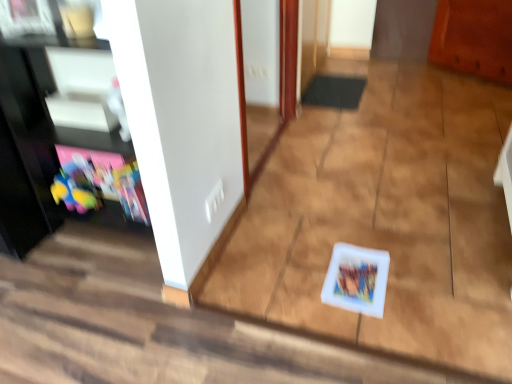
This screenshot has width=512, height=384. Describe the element at coordinates (474, 38) in the screenshot. I see `wooden cabinet at upper right` at that location.

The width and height of the screenshot is (512, 384). In order to click on wooden cabinet at upper right in this screenshot , I will do pos(474,38).

Image resolution: width=512 pixels, height=384 pixels. What do you see at coordinates (153, 326) in the screenshot?
I see `white plastic book at center` at bounding box center [153, 326].

Find the location of a particular element. Image resolution: width=512 pixels, height=384 pixels. white plastic book at center is located at coordinates (153, 326).

The height and width of the screenshot is (384, 512). What do you see at coordinates (357, 279) in the screenshot? I see `white matte card game at center` at bounding box center [357, 279].

Looking at this image, measure the distance between point (x=242, y=24) and camera.

Point (x=242, y=24) and camera are 8.22 feet apart from each other.

I want to click on wooden cabinet at upper right, so click(x=474, y=38).

Consider the image. Considering the sizes of white matte card game at center and white plastic book at center in the image, is white matte card game at center taller or shorter than white plastic book at center?

In the image, white matte card game at center appears to be shorter than white plastic book at center.

Is white matte card game at center oriented towards white plastic book at center?

Yes, white matte card game at center is turned towards white plastic book at center.

Can we say white matte card game at center lies outside white plastic book at center?

No, white matte card game at center is not entirely external to white plastic book at center.

From the image's perspective, which is below, white matte card game at center or white plastic book at center?

white plastic book at center is shown below in the image.

Does black rubber doormat at center lie in front of matt black shelf at left?

No, black rubber doormat at center is further to the viewer.

How many degrees apart are the facing directions of black rubber doormat at center and matt black shelf at left?

black rubber doormat at center and matt black shelf at left are facing 90 degrees away from each other.

From the image's perspective, is black rubber doormat at center under matt black shelf at left?

Actually, black rubber doormat at center appears above matt black shelf at left in the image.

From the picture: Is black rubber doormat at center located outside matt black shelf at left?

black rubber doormat at center is positioned outside matt black shelf at left.

Is white plastic book at center not near matt black shelf at left?

No, white plastic book at center is in close proximity to matt black shelf at left.

From a real-world perspective, which object rests below the other?

white plastic book at center, from a real-world perspective.

Between point (254, 375) and point (88, 188), which one is positioned behind?

Positioned behind is point (88, 188).

Does black rubber doormat at center turn towards white plastic book at center?

No.

Would you say black rubber doormat at center is a long distance from white plastic book at center?

That's right, there is a large distance between black rubber doormat at center and white plastic book at center.

Is black rubber doormat at center wider than white plastic book at center?

No, black rubber doormat at center is not wider than white plastic book at center.

From the image's perspective, is black rubber doormat at center above or below white plastic book at center?

Clearly, from the image's perspective, black rubber doormat at center is above white plastic book at center.

Considering the sizes of black glossy entertainment center at left and white matte card game at center in the image, is black glossy entertainment center at left wider or thinner than white matte card game at center?

In the image, black glossy entertainment center at left appears to be wider than white matte card game at center.

What's the angular difference between black glossy entertainment center at left and white matte card game at center's facing directions?

There is a 180-degree angle between the facing directions of black glossy entertainment center at left and white matte card game at center.

In the image, is black glossy entertainment center at left positioned in front of or behind white matte card game at center?

In the image, black glossy entertainment center at left appears in front of white matte card game at center.

Is black glossy entertainment center at left looking in the opposite direction of white matte card game at center?

No, black glossy entertainment center at left is not facing away from white matte card game at center.

In the image, is white matte card game at center on the left side or the right side of matt black shelf at left?

From the image, it's evident that white matte card game at center is to the right of matt black shelf at left.

Can you confirm if white matte card game at center is taller than matt black shelf at left?

In fact, white matte card game at center may be shorter than matt black shelf at left.

In the image, is white matte card game at center positioned in front of or behind matt black shelf at left?

Clearly, white matte card game at center is in front of matt black shelf at left.

Between white matte card game at center and matt black shelf at left, which one has larger width?

Wider between the two is white matte card game at center.

Could you tell me if wooden cabinet at upper right is turned towards white plastic book at center?

Yes, wooden cabinet at upper right is oriented towards white plastic book at center.

Is there a large distance between wooden cabinet at upper right and white plastic book at center?

Yes, wooden cabinet at upper right and white plastic book at center are located far from each other.

Considering the sizes of objects wooden cabinet at upper right and white plastic book at center in the image provided, who is shorter, wooden cabinet at upper right or white plastic book at center?

With less height is white plastic book at center.

You are a GUI agent. You are given a task and a screenshot of the screen. Output one action in this format:
    pyautogui.click(x=<x>, y=<y>)
    Task: Click on the stair above the white matte card game at center (from a real-world perspective)
    The image size is (512, 384).
    Given the screenshot: What is the action you would take?
    pyautogui.click(x=153, y=326)

Identify the location of doormat located behind the matt black shelf at left. (334, 91).

Considering their positions, is white matte card game at center positioned closer to wooden cabinet at upper right than black rubber doormat at center?

black rubber doormat at center is positioned closer to the anchor wooden cabinet at upper right.

Looking at the image, which one is located further to white glossy door at center, white plastic book at center or black rubber doormat at center?

white plastic book at center is positioned further to the anchor white glossy door at center.

From the image, which object appears to be nearer to black glossy entertainment center at left, white plastic book at center or white glossy door at center?

white plastic book at center.

Looking at the image, which one is located closer to white plastic book at center, matt black shelf at left or wooden cabinet at upper right?

The object closer to white plastic book at center is matt black shelf at left.

Estimate the real-world distances between objects in this image. Which object is further from matt black shelf at left, white matte card game at center or black glossy entertainment center at left?

white matte card game at center is positioned further to the anchor matt black shelf at left.

Based on their spatial positions, is white glossy door at center or wooden cabinet at upper right further from matt black shelf at left?

Among the two, wooden cabinet at upper right is located further to matt black shelf at left.

Based on their spatial positions, is white matte card game at center or matt black shelf at left further from black glossy entertainment center at left?

Result: Based on the image, white matte card game at center appears to be further to black glossy entertainment center at left.

Based on their spatial positions, is black rubber doormat at center or wooden cabinet at upper right further from white glossy door at center?

The object further to white glossy door at center is wooden cabinet at upper right.

The height and width of the screenshot is (384, 512). In order to click on doormat between black glossy entertainment center at left and wooden cabinet at upper right in this screenshot , I will do `click(334, 91)`.

I want to click on entertainment center between white glossy door at center and white plastic book at center in the up-down direction, so click(x=64, y=131).

This screenshot has height=384, width=512. Find the location of `shelf positioned between black glossy entertainment center at left and black rubber doormat at center from near to far`. shelf positioned between black glossy entertainment center at left and black rubber doormat at center from near to far is located at coordinates pos(106,179).

You are a GUI agent. You are given a task and a screenshot of the screen. Output one action in this format:
    pyautogui.click(x=<x>, y=<y>)
    Task: Click on the card game located between white plastic book at center and wooden cabinet at upper right in the depth direction
    
    Given the screenshot: What is the action you would take?
    pyautogui.click(x=357, y=279)